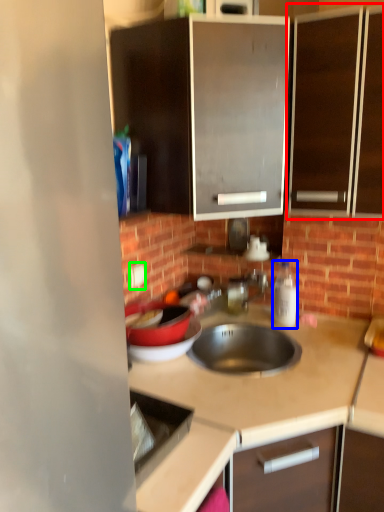
Question: Considering the real-world distances, which object is closest to cabinetry (highlighted by a red box)? bottle (highlighted by a blue box) or electric outlet (highlighted by a green box).

Choices:
 (A) bottle
 (B) electric outlet

Answer: (A)